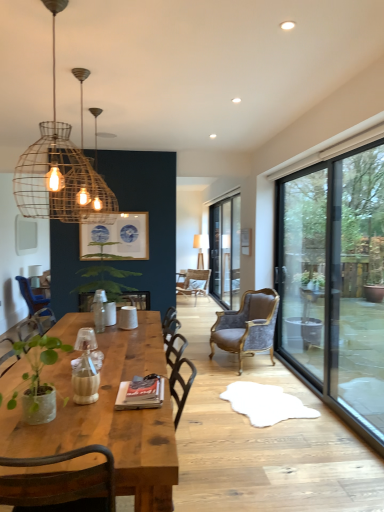
Question: Is rustic wire pendant light at upper left further to the viewer compared to white matte cup at center?

Choices:
 (A) yes
 (B) no

Answer: (B)

Question: Are rustic wire pendant light at upper left and white matte cup at center beside each other?

Choices:
 (A) no
 (B) yes

Answer: (A)

Question: Is rustic wire pendant light at upper left facing towards white matte cup at center?

Choices:
 (A) no
 (B) yes

Answer: (A)

Question: Considering the relative sizes of rustic wire pendant light at upper left and white matte cup at center in the image provided, is rustic wire pendant light at upper left wider than white matte cup at center?

Choices:
 (A) yes
 (B) no

Answer: (A)

Question: Is rustic wire pendant light at upper left bigger than white matte cup at center?

Choices:
 (A) no
 (B) yes

Answer: (B)

Question: From a real-world perspective, is blue paper picture frame at upper center physically located above or below green leafy plant at center, the 2th houseplant viewed from the front?

Choices:
 (A) below
 (B) above

Answer: (B)

Question: Is blue paper picture frame at upper center spatially inside green leafy plant at center, the 2th houseplant viewed from the front, or outside of it?

Choices:
 (A) inside
 (B) outside

Answer: (B)

Question: Visually, is blue paper picture frame at upper center positioned to the left or to the right of green leafy plant at center, the 1th houseplant from the back?

Choices:
 (A) left
 (B) right

Answer: (A)

Question: Considering the positions of blue paper picture frame at upper center and green leafy plant at center, the 2th houseplant viewed from the front, in the image, is blue paper picture frame at upper center bigger or smaller than green leafy plant at center, the 2th houseplant viewed from the front,?

Choices:
 (A) small
 (B) big

Answer: (A)

Question: Is green matte plant at lower left, the first houseplant from the front, in front of or behind white matte cup at center in the image?

Choices:
 (A) behind
 (B) front

Answer: (B)

Question: Which is correct: green matte plant at lower left, the first houseplant from the front, is inside white matte cup at center, or outside of it?

Choices:
 (A) inside
 (B) outside

Answer: (B)

Question: In terms of width, does green matte plant at lower left, the first houseplant from the front, look wider or thinner when compared to white matte cup at center?

Choices:
 (A) thin
 (B) wide

Answer: (B)

Question: From the image's perspective, is green matte plant at lower left, the first houseplant from the front, positioned above or below white matte cup at center?

Choices:
 (A) below
 (B) above

Answer: (A)

Question: Is green matte plant at lower left, the first houseplant from the front, to the left or to the right of rustic wire pendant light at upper left in the image?

Choices:
 (A) right
 (B) left

Answer: (B)

Question: From the image's perspective, is green matte plant at lower left, the first houseplant from the front, positioned above or below rustic wire pendant light at upper left?

Choices:
 (A) above
 (B) below

Answer: (B)